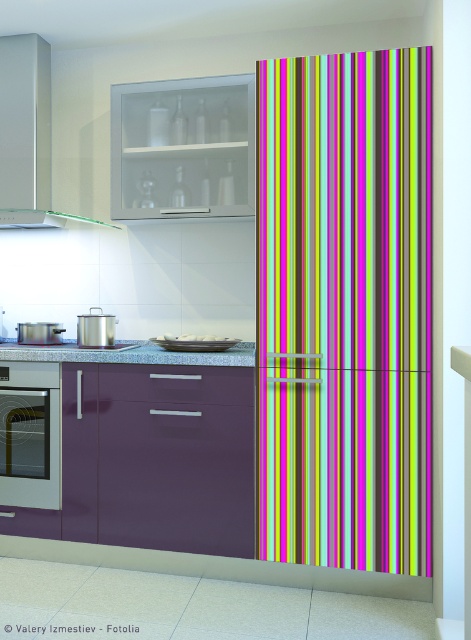
In the scene shown: Which is more to the left, granite countertop at center or satin silver stove at lower left?

satin silver stove at lower left is more to the left.

Does granite countertop at center come in front of satin silver stove at lower left?

Yes, it is.

This screenshot has height=640, width=471. Find the location of `granite countertop at center`. granite countertop at center is located at coordinates (128, 353).

Find the location of a particular element. This screenshot has width=471, height=640. satin silver pot at center is located at coordinates (96, 330).

Does point (89, 337) lie in front of point (51, 349)?

No, (89, 337) is further to viewer.

Locate an element on the screen. satin silver pot at center is located at coordinates (96, 330).

Does matte white exhaust hood at upper left have a larger size compared to satin silver toaster at lower left?

Yes, matte white exhaust hood at upper left is bigger than satin silver toaster at lower left.

Which of these two, matte white exhaust hood at upper left or satin silver toaster at lower left, stands taller?

matte white exhaust hood at upper left is taller.

What do you see at coordinates (25, 125) in the screenshot? This screenshot has width=471, height=640. I see `matte white exhaust hood at upper left` at bounding box center [25, 125].

The image size is (471, 640). Identify the location of matte white exhaust hood at upper left. (25, 125).